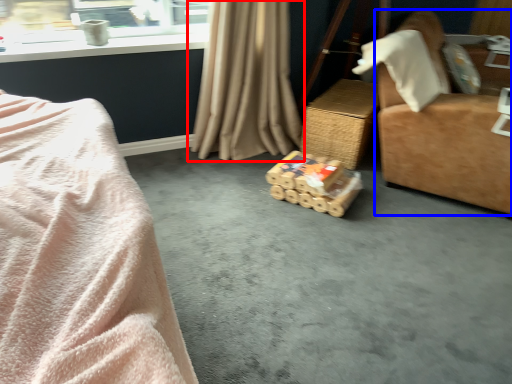
Question: Which of the following is the farthest to the observer, curtain (highlighted by a red box) or furniture (highlighted by a blue box)?

Choices:
 (A) curtain
 (B) furniture

Answer: (A)